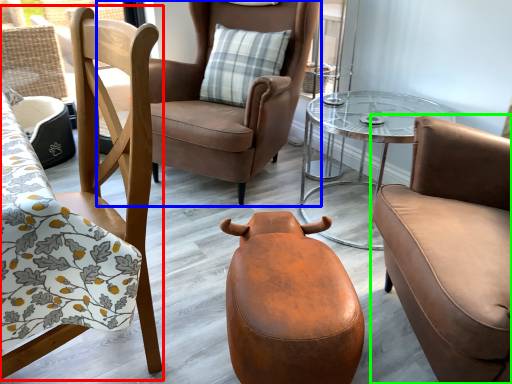
Question: Which is farther away from chair (highlighted by a red box)? chair (highlighted by a blue box) or chair (highlighted by a green box)?

Choices:
 (A) chair
 (B) chair

Answer: (A)